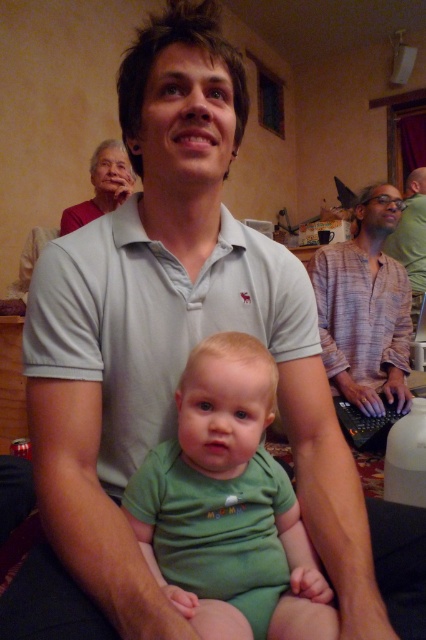
Question: Which point is closer to the camera taking this photo?

Choices:
 (A) (351, 346)
 (B) (275, 502)

Answer: (B)

Question: Is light gray cotton polo shirt at center to the left of striped cotton shirt at right from the viewer's perspective?

Choices:
 (A) no
 (B) yes

Answer: (B)

Question: Does light gray cotton polo shirt at center come behind green cotton onesie at center?

Choices:
 (A) no
 (B) yes

Answer: (B)

Question: Which of the following is the farthest from the observer?

Choices:
 (A) (287, 353)
 (B) (264, 545)
 (C) (344, 264)
 (D) (414, 300)

Answer: (D)

Question: Which point is closer to the camera?

Choices:
 (A) plaid shirt at center
 (B) striped cotton shirt at right
 (C) green cotton onesie at center

Answer: (C)

Question: Is light gray cotton polo shirt at center to the right of striped cotton shirt at right from the viewer's perspective?

Choices:
 (A) yes
 (B) no

Answer: (B)